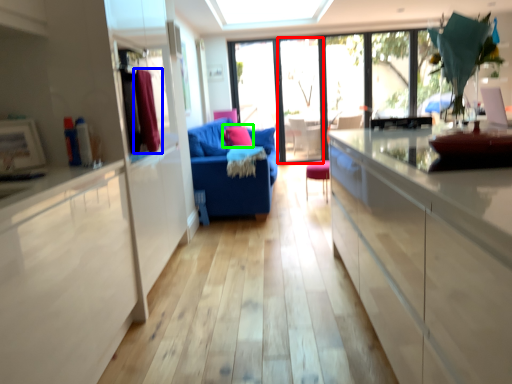
Question: Based on their relative distances, which object is farther from screen door (highlighted by a red box)? Choose from curtain (highlighted by a blue box) and pillow (highlighted by a green box).

Choices:
 (A) curtain
 (B) pillow

Answer: (A)